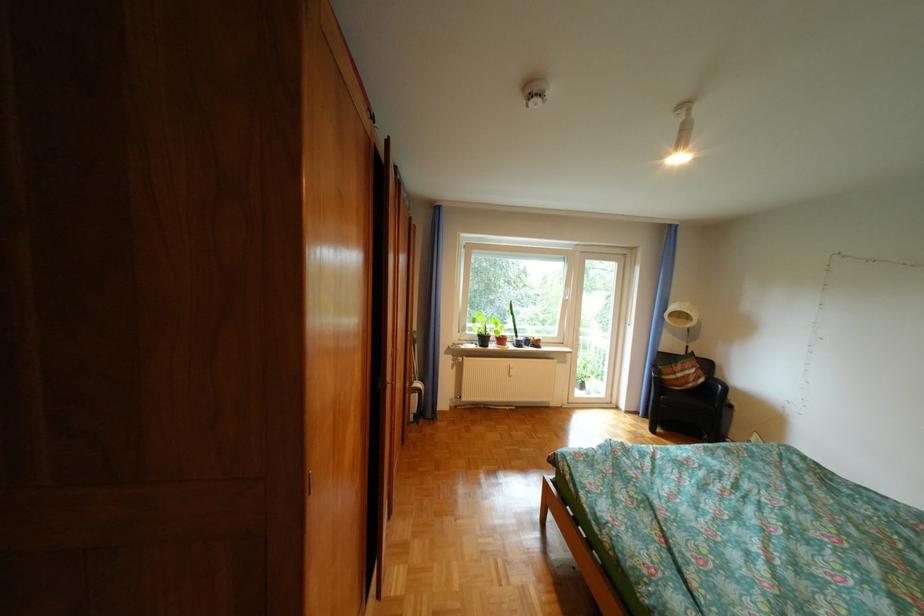
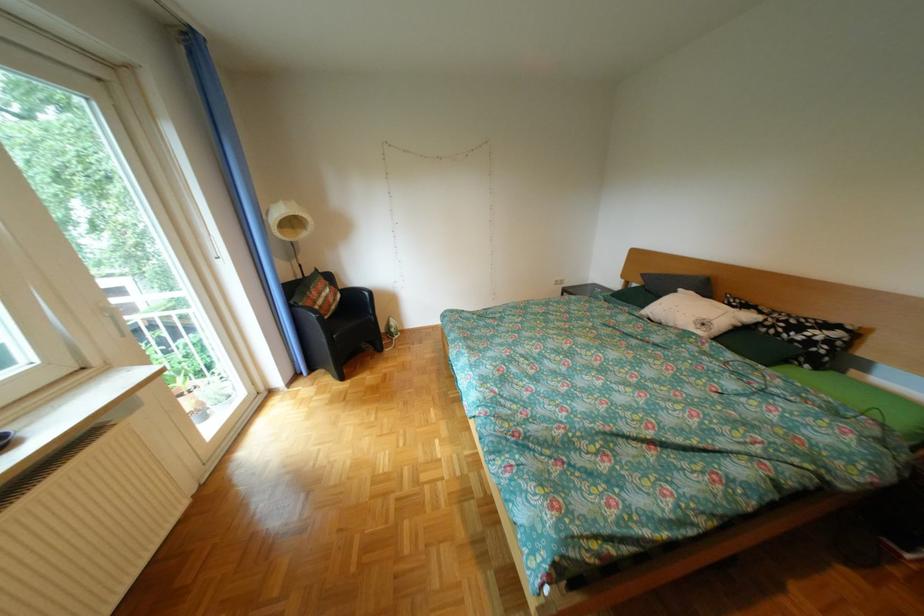
Where in the second image is the point corresponding to the point at 669,367 from the first image?

(306, 307)